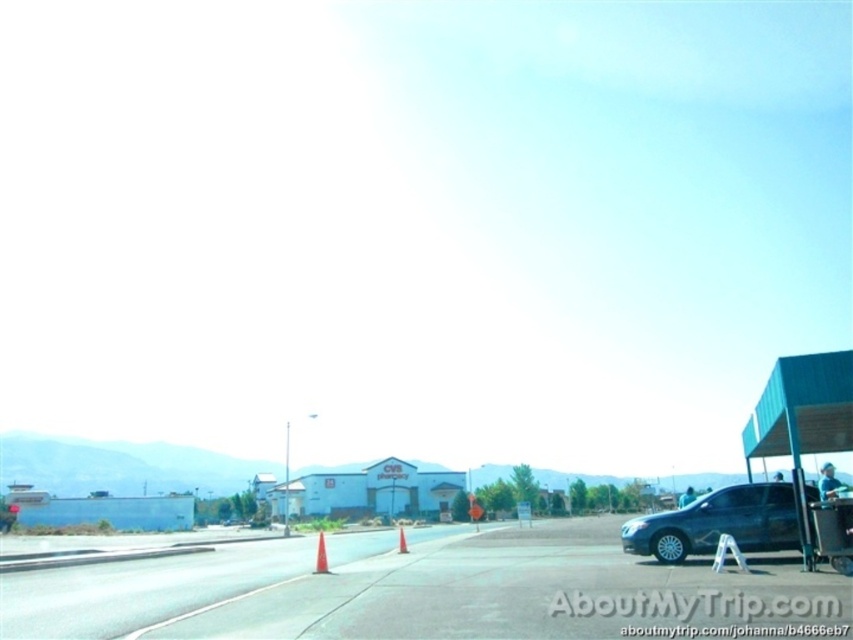
Question: Is orange plastic traffic cone at center wider than metallic orange stop sign at center?

Choices:
 (A) no
 (B) yes

Answer: (B)

Question: Which is farther from the shiny silver sedan at lower right?

Choices:
 (A) metallic orange stop sign at center
 (B) orange plastic traffic cone at center
 (C) asphalt road at center
 (D) smooth gray pole at center

Answer: (D)

Question: Is shiny silver sedan at lower right positioned before orange matte traffic cone at center?

Choices:
 (A) no
 (B) yes

Answer: (B)

Question: Which point is closer to the camera taking this photo?

Choices:
 (A) (401, 541)
 (B) (525, 504)

Answer: (A)

Question: Observing the image, what is the correct spatial positioning of smooth gray pole at center in reference to orange plastic traffic cone at center?

Choices:
 (A) right
 (B) left

Answer: (B)

Question: Considering the real-world distances, which object is farthest from the orange matte traffic cone at center?

Choices:
 (A) shiny silver sedan at lower right
 (B) smooth gray pole at center
 (C) reflective glass stop sign at center
 (D) metallic orange stop sign at center

Answer: (B)